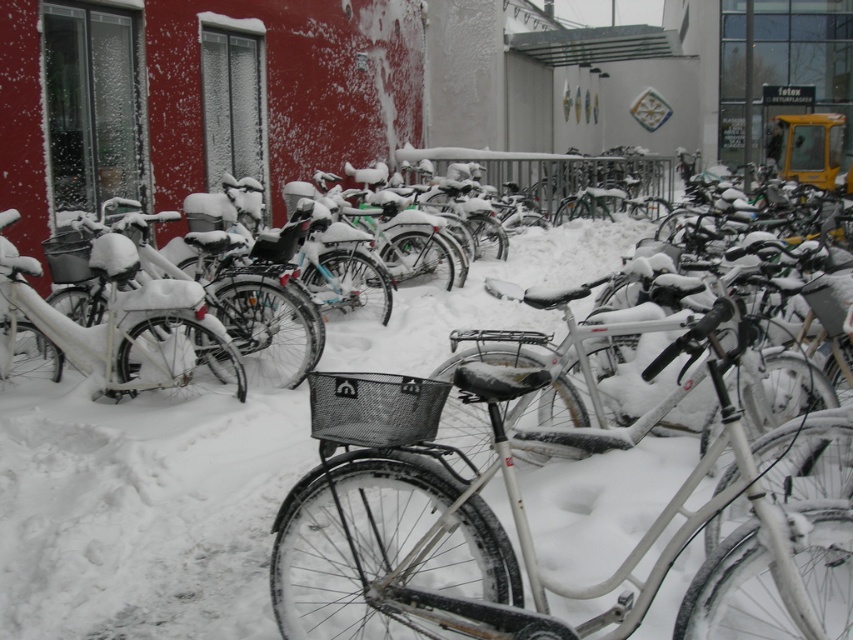
You are standing at the point labeled as point (515,529) in the snowy urban scene. Looking around, you see a white matte bicycle at center. What object are you closest to?

You are closest to the white matte bicycle at center because the point (515,529) indicates its location.

You are a delivery person trying to load packages onto the baskets of the bicycles. You have a package that is too large to fit on the basket of the white matte bicycle at center. Can you place it on the basket of the white matte bicycle at left instead?

The white matte bicycle at center is positioned on the right side of white matte bicycle at left, so the white matte bicycle at left is to the left of the white matte bicycle at center. Since the package is too large for the center bicycle, you can try placing it on the basket of the white matte bicycle at left if its basket is large enough. However, the description does not provide information about basket sizes, so you need to check the basket size of the white matte bicycle at left.